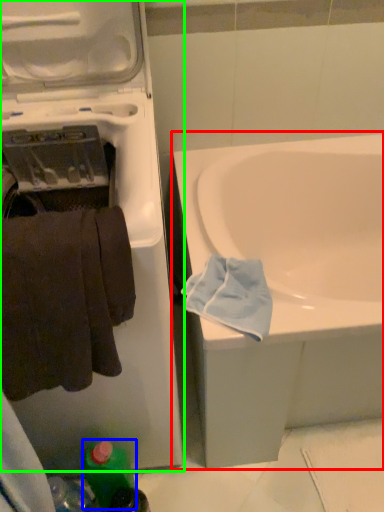
Question: Based on their relative distances, which object is nearer to bathtub (highlighted by a red box)? Choose from bottle (highlighted by a blue box) and washing machine (highlighted by a green box).

Choices:
 (A) bottle
 (B) washing machine

Answer: (B)